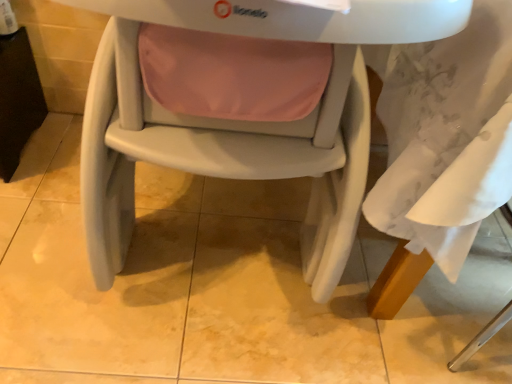
Where is `vacant space underneath matte plastic highchair at center (from a real-world perspective)`? This screenshot has height=384, width=512. vacant space underneath matte plastic highchair at center (from a real-world perspective) is located at coordinates (223, 230).